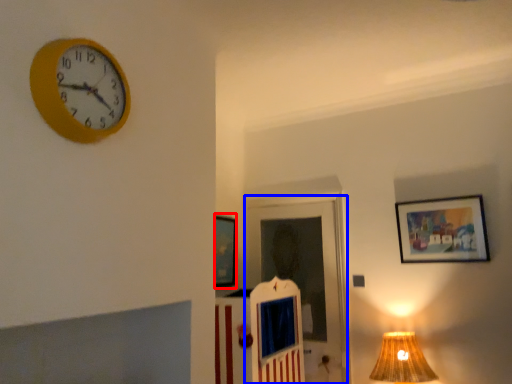
Question: Which object appears closest to the camera in this image, picture frame (highlighted by a red box) or door (highlighted by a blue box)?

Choices:
 (A) picture frame
 (B) door

Answer: (B)